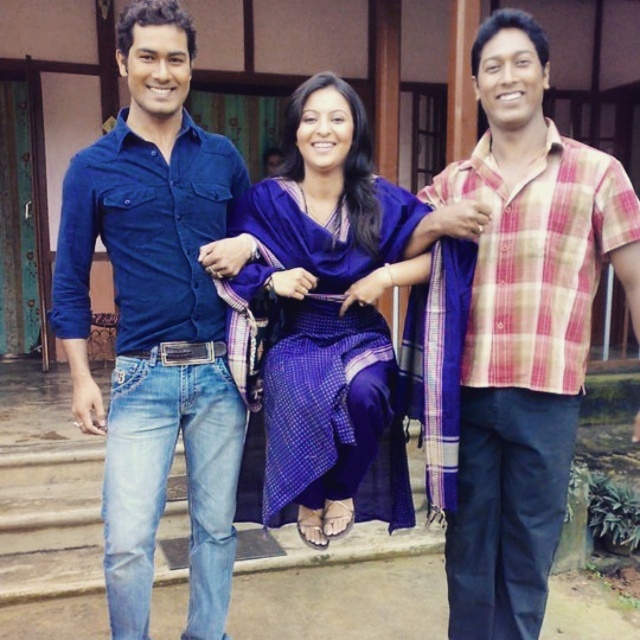
Question: Does purple woven saree at center have a larger size compared to black leather belt at center?

Choices:
 (A) no
 (B) yes

Answer: (B)

Question: Does denim jeans at left lie behind plaid cotton shirt at center?

Choices:
 (A) yes
 (B) no

Answer: (A)

Question: Which point is closer to the camera?

Choices:
 (A) (332, 369)
 (B) (144, 353)

Answer: (A)

Question: Estimate the real-world distances between objects in this image. Which object is closer to the purple woven saree at center?

Choices:
 (A) denim jeans at left
 (B) black leather belt at center

Answer: (A)

Question: Is denim jeans at left above black leather belt at center?

Choices:
 (A) no
 (B) yes

Answer: (B)

Question: Which point is farther to the camera?

Choices:
 (A) (282, 365)
 (B) (512, 310)
 (C) (115, 230)

Answer: (C)